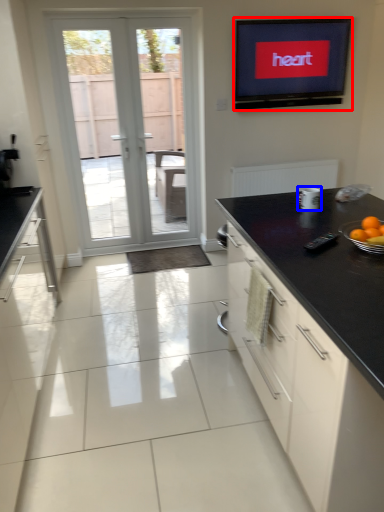
Question: Among these objects, which one is farthest to the camera, electronic (highlighted by a red box) or appliance (highlighted by a blue box)?

Choices:
 (A) electronic
 (B) appliance

Answer: (A)